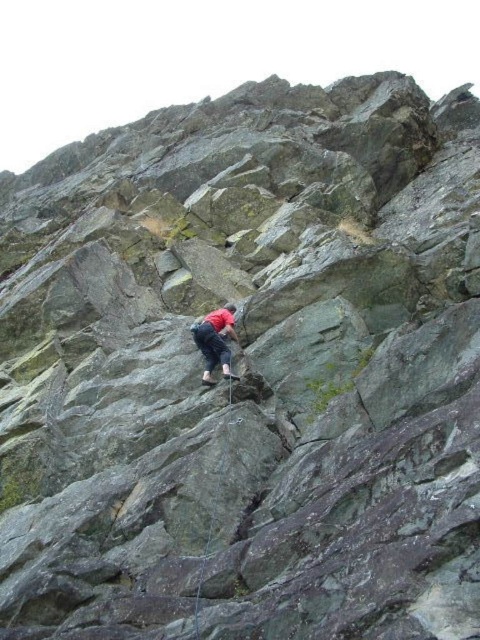
You are a rock climber trying to reach the top of the cliff. You notice a point marked at coordinate (215, 340). What object is this point located on?

The point at coordinate (215, 340) is located on the red fabric shirt at center.

You are a safety officer assessing the climbing site. The safety protocol requires that climbers must be within 50 meters of the base station for emergency response. You observe the red fabric shirt at center. Is the climber within the required distance?

The red fabric shirt at center is 48.96 meters from the viewer, which is within the 50 meters safety protocol distance. Therefore, the climber is within the required distance.